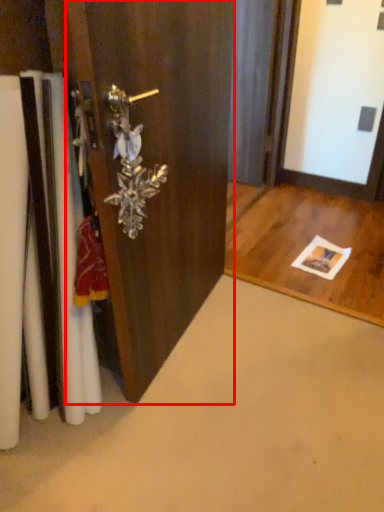
Question: Considering the relative positions of door (annotated by the red box) and door handle in the image provided, where is door (annotated by the red box) located with respect to the staircase?

Choices:
 (A) left
 (B) right

Answer: (B)